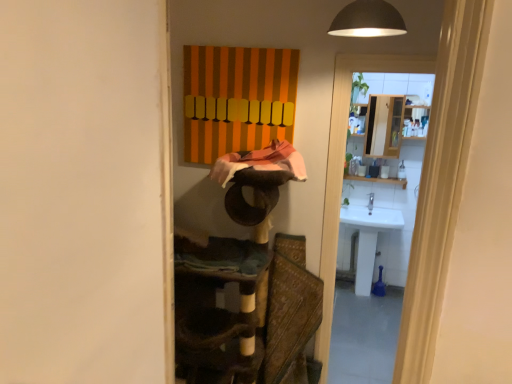
Question: Is white glossy sink at right bigger than white glossy sink at right?

Choices:
 (A) no
 (B) yes

Answer: (B)

Question: Is white glossy sink at right next to white glossy sink at right?

Choices:
 (A) yes
 (B) no

Answer: (B)

Question: From the image's perspective, is white glossy sink at right under white glossy sink at right?

Choices:
 (A) no
 (B) yes

Answer: (B)

Question: Is white glossy sink at right positioned before white glossy sink at right?

Choices:
 (A) no
 (B) yes

Answer: (A)

Question: Is white glossy sink at right shorter than white glossy sink at right?

Choices:
 (A) no
 (B) yes

Answer: (B)

Question: Is white glossy sink at right inside the boundaries of textured brown fabric swivel chair at center, or outside?

Choices:
 (A) inside
 (B) outside

Answer: (B)

Question: Is white glossy sink at right wider or thinner than textured brown fabric swivel chair at center?

Choices:
 (A) wide
 (B) thin

Answer: (B)

Question: Is white glossy sink at right bigger or smaller than textured brown fabric swivel chair at center?

Choices:
 (A) small
 (B) big

Answer: (B)

Question: Is point (330, 246) positioned closer to the camera than point (306, 306)?

Choices:
 (A) farther
 (B) closer

Answer: (A)

Question: Would you say white glossy sink at right is to the left or to the right of white glossy sink at right in the picture?

Choices:
 (A) right
 (B) left

Answer: (A)

Question: From a real-world perspective, is white glossy sink at right physically located above or below white glossy sink at right?

Choices:
 (A) above
 (B) below

Answer: (B)

Question: Is white glossy sink at right bigger or smaller than white glossy sink at right?

Choices:
 (A) big
 (B) small

Answer: (A)

Question: Is white glossy sink at right spatially inside white glossy sink at right, or outside of it?

Choices:
 (A) outside
 (B) inside

Answer: (A)

Question: From a real-world perspective, is textured brown fabric swivel chair at center physically located above or below white glossy sink at right?

Choices:
 (A) below
 (B) above

Answer: (A)

Question: Looking at the image, does textured brown fabric swivel chair at center seem bigger or smaller compared to white glossy sink at right?

Choices:
 (A) small
 (B) big

Answer: (A)